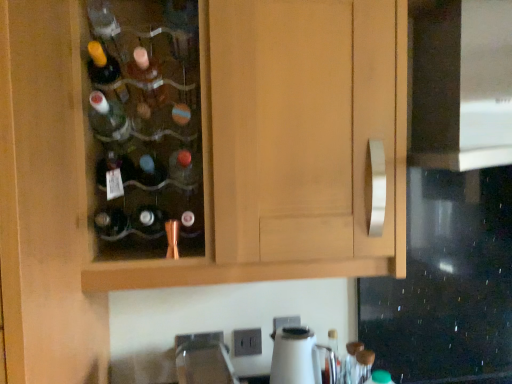
Question: From the image's perspective, is wooden cabinet at center above or below white glossy kettle at lower center?

Choices:
 (A) above
 (B) below

Answer: (A)

Question: From a real-world perspective, is wooden cabinet at center positioned above or below white glossy kettle at lower center?

Choices:
 (A) below
 (B) above

Answer: (B)

Question: Which is farther from the satin nickel faucet at lower center?

Choices:
 (A) black glass oven at right
 (B) white glossy kettle at lower center
 (C) matte glass bottle at center
 (D) wooden cabinet at center

Answer: (A)

Question: Estimate the real-world distances between objects in this image. Which object is farther from the satin nickel faucet at lower center?

Choices:
 (A) black glass oven at right
 (B) wooden cabinet at center
 (C) white glossy kettle at lower center
 (D) matte glass bottle at center

Answer: (A)